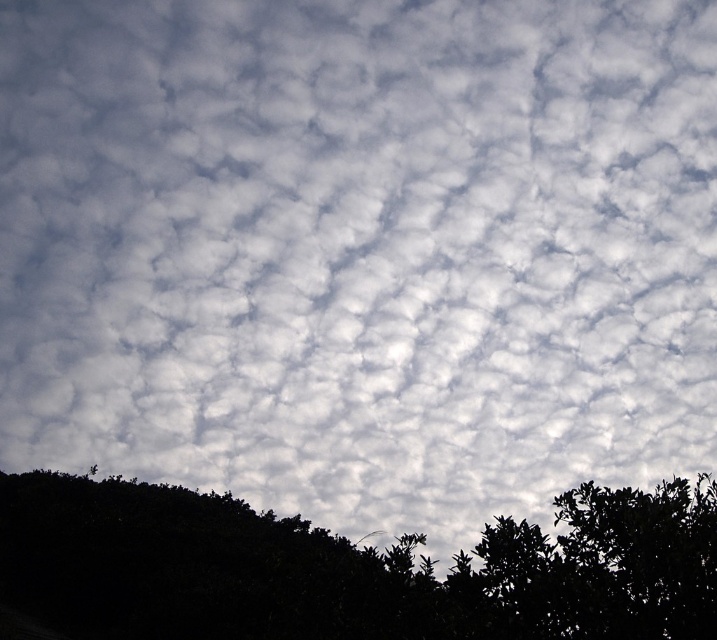
You are an artist painting a landscape and want to ensure the dark green foliage at lower left and the green leafy tree at lower right are proportionally accurate. Based on the scene, which object should you draw larger?

The dark green foliage at lower left should be drawn larger since it has a larger size compared to the green leafy tree at lower right according to the description.

You are a landscape architect designing a garden path that must pass between the dark green foliage at lower left and the green leafy tree at lower right. The path needs to be at least 3.5 meters wide to accommodate a wheelchair. Based on the scene, will the existing space between these two objects allow for this requirement?

The distance between the dark green foliage at lower left and the green leafy tree at lower right is 4.02 meters, which exceeds the required 3.5 meters. Therefore, the existing space is sufficient to accommodate a 3.5 meter wide wheelchair path.

You are a bird flying over the scene and want to land on the tallest vegetation. Which one should you choose between the dark green foliage at lower left and the green leafy tree at lower right?

The dark green foliage at lower left is much taller than the green leafy tree at lower right, so you should land on the dark green foliage at lower left.